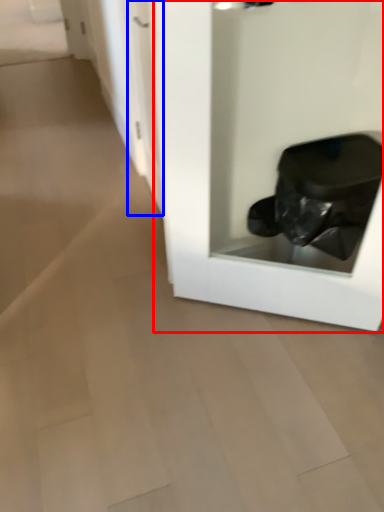
Question: Among these objects, which one is nearest to the camera, glass door (highlighted by a red box) or door (highlighted by a blue box)?

Choices:
 (A) glass door
 (B) door

Answer: (A)